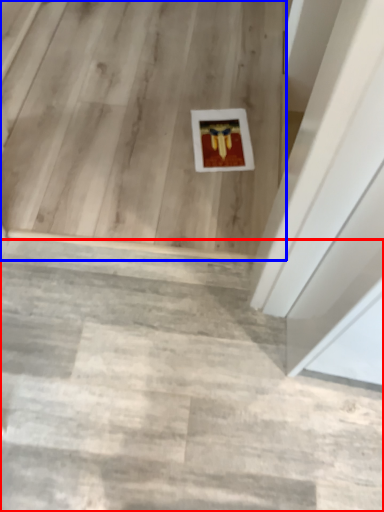
Question: Which of the following is the farthest to the observer, stairwell (highlighted by a red box) or stairwell (highlighted by a blue box)?

Choices:
 (A) stairwell
 (B) stairwell

Answer: (B)